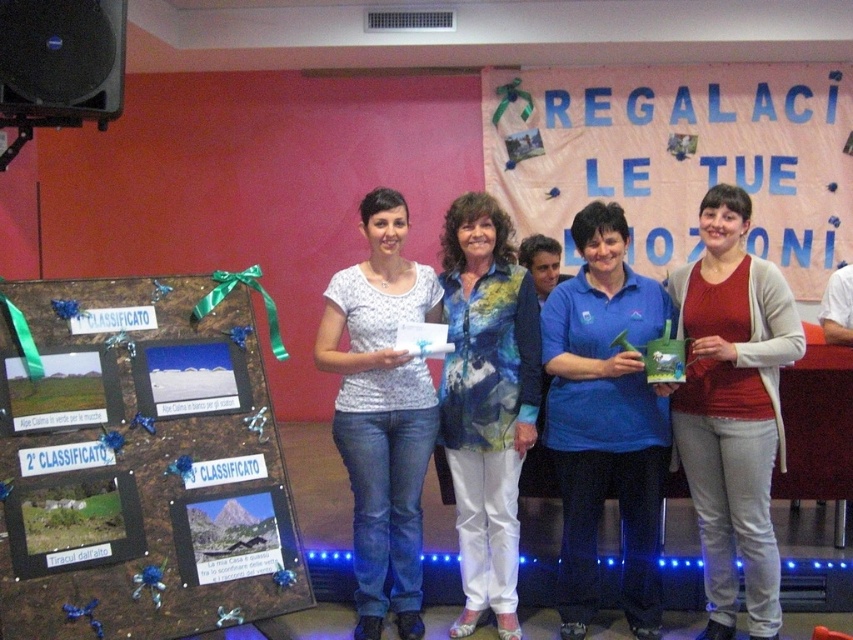
Based on the scene description, where exactly is the white printed shirt at center located in the image?

The white printed shirt at center is located at point 0.645 on the x axis and 0.449 on the y axis.

You are organizing a photo album and want to place a divider between the brown wooden board at left and the blue fabric shirt at center. Which object should the divider be placed closer to if the divider needs to be smaller than both?

The divider should be placed closer to the blue fabric shirt at center because the brown wooden board at left is larger in size than the blue fabric shirt at center, making the blue fabric shirt at center the smaller object.